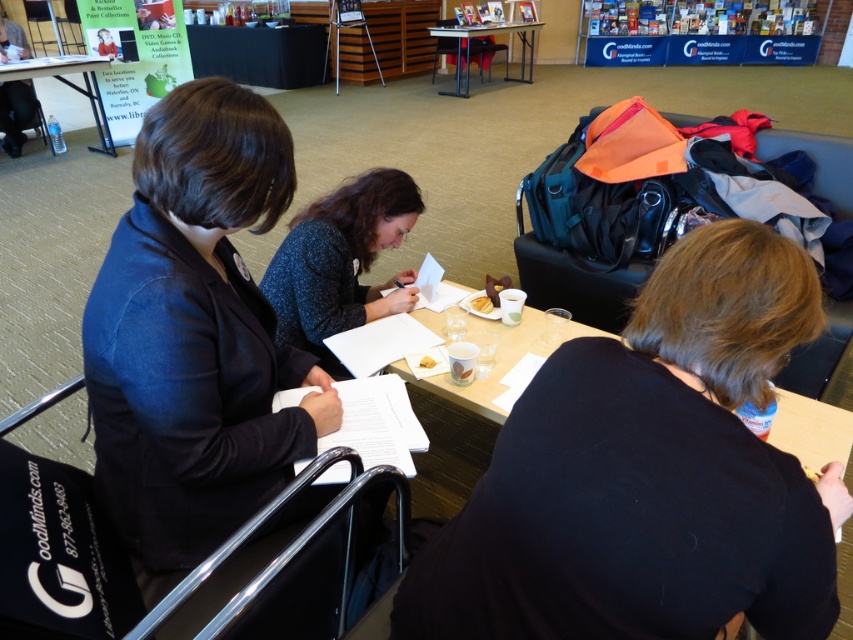
What are the coordinates of the sparkly blue sweater at center?

The sparkly blue sweater at center is located at coordinates point (341, 262).

You are a guest at this event and want to place a small snack on the table. The white paper plate at center is already there. Considering the sparkly blue sweater at center is much taller than the plate, is there a risk the snack might fall off the table if placed near the plate?

The sparkly blue sweater at center is much taller than the white paper plate at center, so placing the snack near the plate could be risky because the sweater might block access or cause the plate to shift if moved. Ensure the snack is placed stably away from the sweater.

Consider the image. You are planning to place a small potted plant on the table in the image. The table is at point (x=68, y=84). If you want to place the plant exactly at the center of the table, what coordinates should you use?

The center of the white plastic table at upper left would be at the coordinates (x=68, y=84), so placing the plant there would center it.